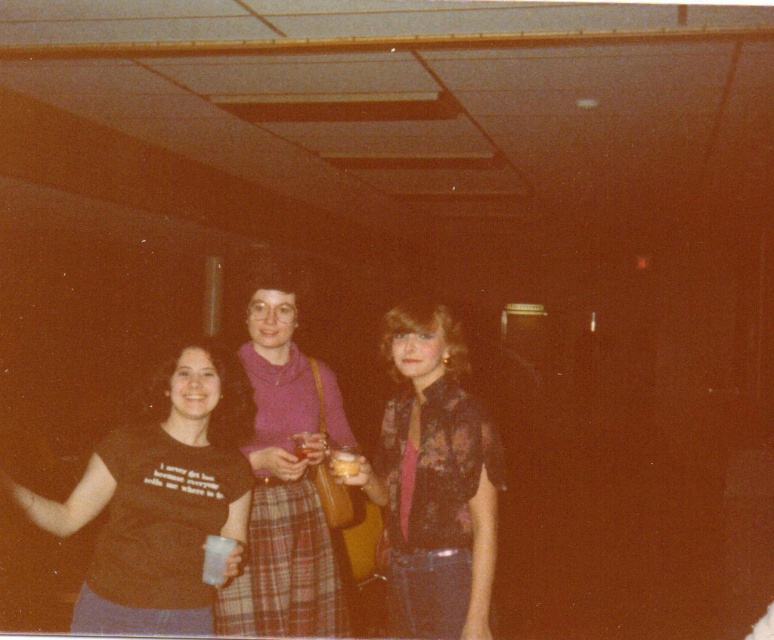
Question: Which object appears farthest from the camera in this image?

Choices:
 (A) floral-patterned blouse at center
 (B) purple plaid skirt at center

Answer: (B)

Question: Can you confirm if black t-shirt at left is positioned below translucent plastic cup at center?

Choices:
 (A) yes
 (B) no

Answer: (A)

Question: Among these objects, which one is nearest to the camera?

Choices:
 (A) floral-patterned blouse at center
 (B) black t-shirt at left
 (C) translucent plastic cup at center

Answer: (B)

Question: Observing the image, what is the correct spatial positioning of black t-shirt at left in reference to translucent plastic cup at center?

Choices:
 (A) above
 (B) below

Answer: (B)

Question: Can you confirm if black t-shirt at left is positioned above floral-patterned blouse at center?

Choices:
 (A) yes
 (B) no

Answer: (A)

Question: Estimate the real-world distances between objects in this image. Which object is closer to the black t-shirt at left?

Choices:
 (A) floral-patterned blouse at center
 (B) purple plaid skirt at center
 (C) translucent plastic cup at center

Answer: (B)